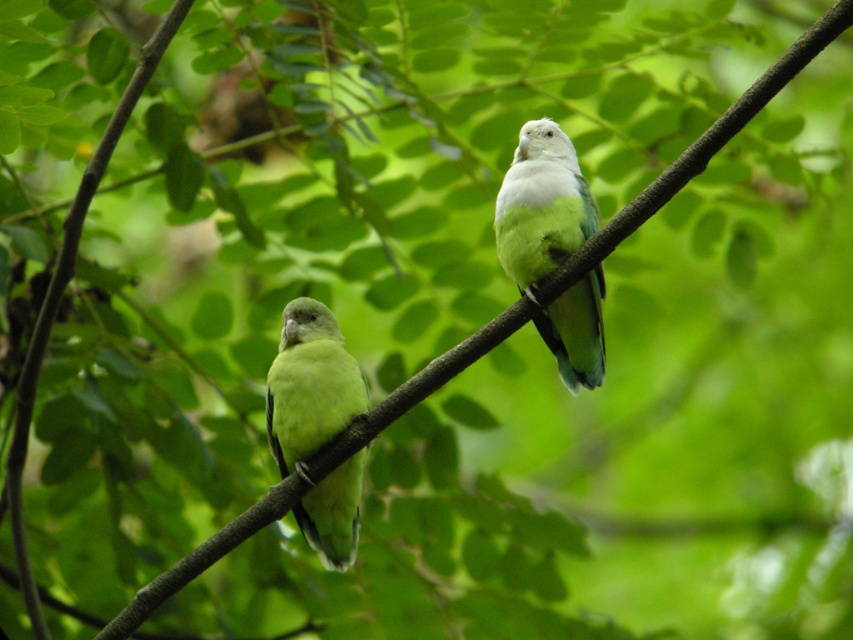
Question: Is green matte parrot at center wider than green matte parrot at left?

Choices:
 (A) no
 (B) yes

Answer: (B)

Question: Which point is closer to the camera?

Choices:
 (A) (339, 348)
 (B) (529, 179)

Answer: (A)

Question: Does green matte parrot at center have a greater width compared to green matte parrot at left?

Choices:
 (A) no
 (B) yes

Answer: (B)

Question: Is green matte parrot at center bigger than green matte parrot at left?

Choices:
 (A) yes
 (B) no

Answer: (A)

Question: Which object is closer to the camera taking this photo?

Choices:
 (A) green matte parrot at left
 (B) green matte parrot at center

Answer: (A)